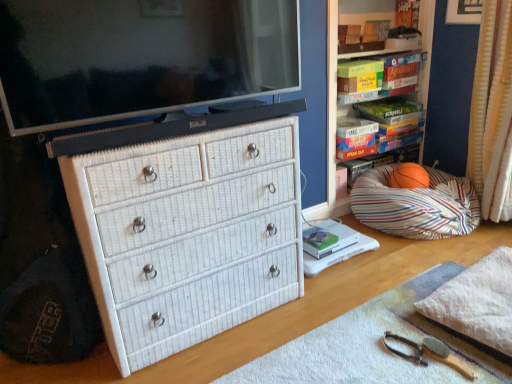
Find the location of `spots to the right of hardcover book at center, the first book from the front`. spots to the right of hardcover book at center, the first book from the front is located at coordinates (340, 237).